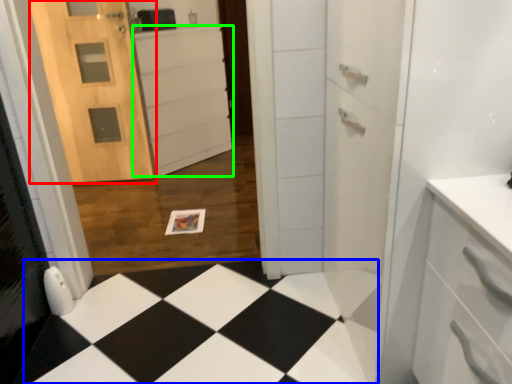
Question: Estimate the real-world distances between objects in this image. Which object is farther from door (highlighted by a red box), square (highlighted by a blue box) or cabinetry (highlighted by a green box)?

Choices:
 (A) square
 (B) cabinetry

Answer: (A)